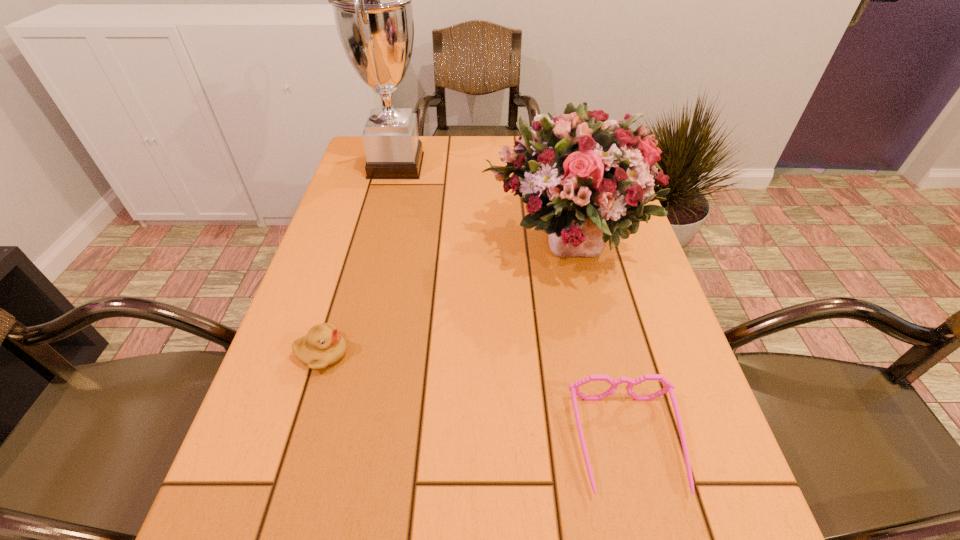
This screenshot has width=960, height=540. I want to click on the tallest object, so click(x=371, y=0).

Find the location of a particular element. the fourth shortest object is located at coordinates (585, 180).

This screenshot has width=960, height=540. I want to click on bouquet, so click(585, 180).

The width and height of the screenshot is (960, 540). Identify the location of beer can. (537, 118).

I want to click on the second nearest object, so click(323, 346).

Locate an element on the screen. The height and width of the screenshot is (540, 960). spectacles is located at coordinates (668, 387).

Image resolution: width=960 pixels, height=540 pixels. Identify the location of vacant area located 0.260m at the front view of the trophy cup. (515, 165).

Locate an element on the screen. The image size is (960, 540). free space located 0.210m on the back of the third farthest object is located at coordinates (545, 160).

The height and width of the screenshot is (540, 960). In order to click on free space located on the left of the third shortest object in this screenshot , I will do `click(420, 158)`.

The image size is (960, 540). What are the coordinates of `blank space located 0.090m at the beak of the duckling` in the screenshot? It's located at [x=395, y=354].